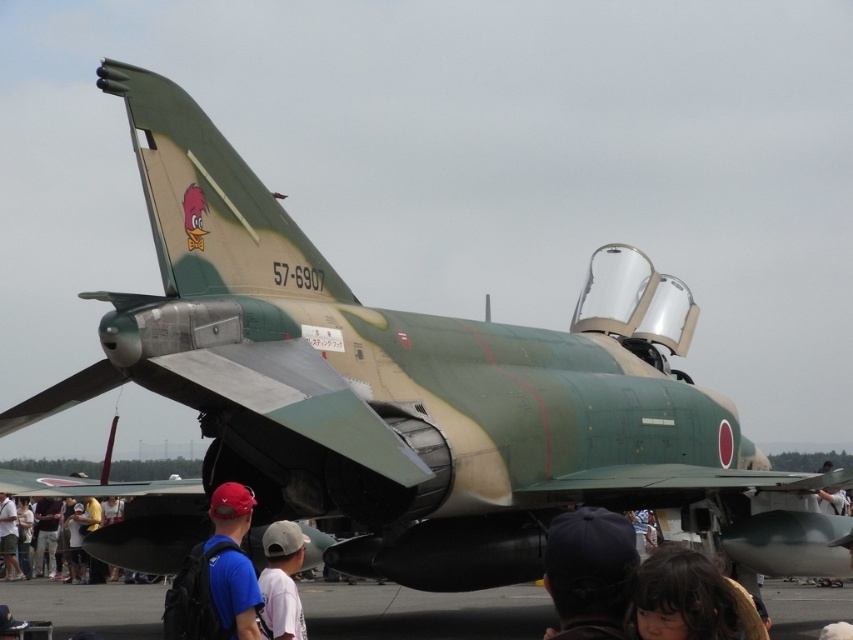
Question: Considering the relative positions of dark blue fabric cap at lower center and dark brown hair at lower center in the image provided, where is dark blue fabric cap at lower center located with respect to dark brown hair at lower center?

Choices:
 (A) left
 (B) right

Answer: (A)

Question: Among these objects, which one is nearest to the camera?

Choices:
 (A) dark brown hair at lower center
 (B) dark blue fabric cap at lower center

Answer: (A)

Question: Is dark blue fabric cap at lower center to the left of white matte cap at center from the viewer's perspective?

Choices:
 (A) yes
 (B) no

Answer: (B)

Question: Can you confirm if matte blue shirt at center is wider than dark brown hair at lower center?

Choices:
 (A) no
 (B) yes

Answer: (B)

Question: Which point is farther to the camera?

Choices:
 (A) (212, 605)
 (B) (15, 531)
 (C) (677, 588)
 (D) (291, 624)

Answer: (B)

Question: Which point appears farthest from the camera in this image?

Choices:
 (A) [567, 547]
 (B) [169, 632]

Answer: (B)